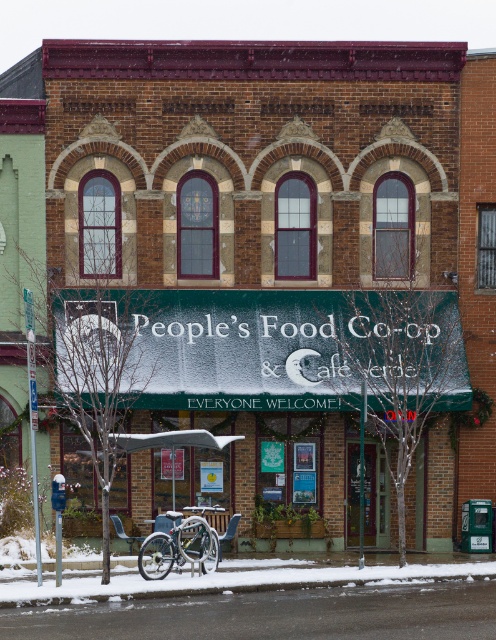
You are a delivery person trying to park your bike on the snow covered sidewalk. The bike you are trying to park is as wide as the silver metallic bicycle at lower center. Can you park your bike on the white powdery snow at lower center without overlapping the snow area?

The white powdery snow at lower center has a width less than the silver metallic bicycle at lower center. Since your bike is as wide as the bicycle, it would not fit within the snow area, so you cannot park it there without overlapping.

You are a delivery person who needs to park your bike near the Cafe Verde. The snow is covering the sidewalk. Is the silver metallic bicycle at lower center currently parked on the white powdery snow at lower center?

Yes, the silver metallic bicycle at lower center is parked on the white powdery snow at lower center because the snow is located below the bicycle, indicating it is sitting on top of the snow.

You are standing on the sidewalk in front of the building and want to place a small snowman using the white powdery snow at lower center. Can you build it in front of the silver metallic bicycle at lower center without the snow touching the bicycle?

The white powdery snow at lower center is closer to the viewer than the silver metallic bicycle at lower center, so the snow is in front of the bicycle. Therefore, you can build the snowman in the snow area in front of the bicycle without it touching the bicycle.